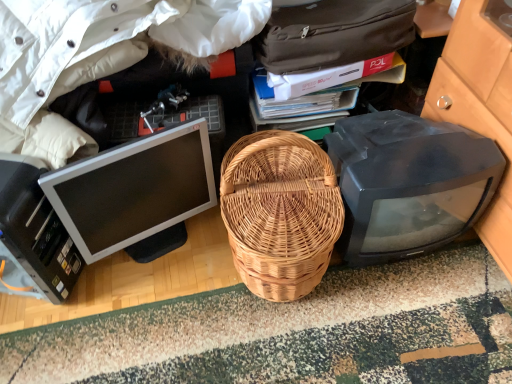
Measure the distance between matte black monitor at right, which is the 2th computer monitor in left-to-right order, and camera.

matte black monitor at right, which is the 2th computer monitor in left-to-right order, and camera are 35.65 inches apart.

Where is `white glossy computer monitor at left, arranged as the second computer monitor when viewed from the right`? white glossy computer monitor at left, arranged as the second computer monitor when viewed from the right is located at coordinates (134, 189).

Locate an element on the screen. The width and height of the screenshot is (512, 384). white cotton jacket at upper left is located at coordinates (97, 56).

Image resolution: width=512 pixels, height=384 pixels. What do you see at coordinates (33, 235) in the screenshot? I see `black plastic printer at lower left` at bounding box center [33, 235].

This screenshot has width=512, height=384. I want to click on matte black monitor at right, which is the 2th computer monitor in left-to-right order, so click(409, 183).

Based on the photo, how far apart are natural wicker picnic basket at center and white cotton jacket at upper left?

A distance of 40.53 centimeters exists between natural wicker picnic basket at center and white cotton jacket at upper left.

Which is behind, point (252, 271) or point (73, 14)?

The point (252, 271) is farther from the camera.

Considering the positions of objects natural wicker picnic basket at center and white cotton jacket at upper left in the image provided, who is in front, natural wicker picnic basket at center or white cotton jacket at upper left?

Positioned in front is white cotton jacket at upper left.

Which is more to the right, natural wicker picnic basket at center or white cotton jacket at upper left?

natural wicker picnic basket at center.

Which is correct: natural wicker picnic basket at center is inside matte black monitor at right, which is the 2th computer monitor in left-to-right order, or outside of it?

natural wicker picnic basket at center lies outside matte black monitor at right, which is the 2th computer monitor in left-to-right order.

Which of these two, natural wicker picnic basket at center or matte black monitor at right, the first computer monitor when ordered from right to left, is wider?

Wider between the two is natural wicker picnic basket at center.

Between natural wicker picnic basket at center and matte black monitor at right, which is the 2th computer monitor in left-to-right order, which one is positioned behind?

matte black monitor at right, which is the 2th computer monitor in left-to-right order, is further from the camera.

Between natural wicker picnic basket at center and matte black monitor at right, which is the 2th computer monitor in left-to-right order, which one appears on the right side from the viewer's perspective?

Positioned to the right is matte black monitor at right, which is the 2th computer monitor in left-to-right order.

Is white cotton jacket at upper left located outside matte black monitor at right, the first computer monitor when ordered from right to left?

That's correct, white cotton jacket at upper left is outside of matte black monitor at right, the first computer monitor when ordered from right to left.

Would you consider white cotton jacket at upper left to be distant from matte black monitor at right, the first computer monitor when ordered from right to left?

No, there isn't a large distance between white cotton jacket at upper left and matte black monitor at right, the first computer monitor when ordered from right to left.

Which is in front, white cotton jacket at upper left or matte black monitor at right, the first computer monitor when ordered from right to left?

white cotton jacket at upper left is more forward.

Measure the distance from black plastic printer at lower left to white glossy computer monitor at left, arranged as the second computer monitor when viewed from the right.

black plastic printer at lower left is 6.04 inches away from white glossy computer monitor at left, arranged as the second computer monitor when viewed from the right.

From a real-world perspective, is black plastic printer at lower left under white glossy computer monitor at left, arranged as the second computer monitor when viewed from the right?

No, from a real-world perspective, black plastic printer at lower left is not beneath white glossy computer monitor at left, arranged as the second computer monitor when viewed from the right.

Considering the relative positions of black plastic printer at lower left and white glossy computer monitor at left, arranged as the second computer monitor when viewed from the right, in the image provided, is black plastic printer at lower left to the left of white glossy computer monitor at left, arranged as the second computer monitor when viewed from the right, from the viewer's perspective?

Yes.

Looking at their sizes, would you say black plastic printer at lower left is wider or thinner than white glossy computer monitor at left, the 1th computer monitor when ordered from left to right?

Clearly, black plastic printer at lower left has more width compared to white glossy computer monitor at left, the 1th computer monitor when ordered from left to right.

From a real-world perspective, is natural wicker picnic basket at center physically located above or below white glossy computer monitor at left, the 1th computer monitor when ordered from left to right?

natural wicker picnic basket at center is situated higher than white glossy computer monitor at left, the 1th computer monitor when ordered from left to right, in the real world.

Based on the photo, from the image's perspective, relative to white glossy computer monitor at left, the 1th computer monitor when ordered from left to right, is natural wicker picnic basket at center above or below?

Based on their image positions, natural wicker picnic basket at center is located beneath white glossy computer monitor at left, the 1th computer monitor when ordered from left to right.

From the picture: Who is taller, natural wicker picnic basket at center or white glossy computer monitor at left, arranged as the second computer monitor when viewed from the right?

natural wicker picnic basket at center.

Is point (269, 271) closer to viewer compared to point (169, 158)?

That is True.

Considering the points (426, 225) and (316, 200), which point is in front, point (426, 225) or point (316, 200)?

Point (316, 200)

Does matte black monitor at right, which is the 2th computer monitor in left-to-right order, contain natural wicker picnic basket at center?

No, natural wicker picnic basket at center is located outside of matte black monitor at right, which is the 2th computer monitor in left-to-right order.

From a real-world perspective, is matte black monitor at right, the first computer monitor when ordered from right to left, under natural wicker picnic basket at center?

Correct, in the physical world, matte black monitor at right, the first computer monitor when ordered from right to left, is lower than natural wicker picnic basket at center.

Where is `computer monitor on the right of natural wicker picnic basket at center`? This screenshot has height=384, width=512. computer monitor on the right of natural wicker picnic basket at center is located at coordinates (409, 183).

Which of these two, black plastic printer at lower left or white cotton jacket at upper left, is thinner?

black plastic printer at lower left.

Is black plastic printer at lower left not close to white cotton jacket at upper left?

No, black plastic printer at lower left is not far away from white cotton jacket at upper left.

Consider the image. Between black plastic printer at lower left and white cotton jacket at upper left, which one has more height?

white cotton jacket at upper left.

Between black plastic printer at lower left and white cotton jacket at upper left, which one appears on the right side from the viewer's perspective?

From the viewer's perspective, white cotton jacket at upper left appears more on the right side.

This screenshot has width=512, height=384. What are the coordinates of `picnic basket behind the white cotton jacket at upper left` in the screenshot? It's located at (280, 212).

Locate an element on the screen. Image resolution: width=512 pixels, height=384 pixels. computer monitor that is the 2nd object directly below the natural wicker picnic basket at center (from a real-world perspective) is located at coordinates (409, 183).

Based on their spatial positions, is black plastic printer at lower left or white glossy computer monitor at left, arranged as the second computer monitor when viewed from the right, further from matte black monitor at right, the first computer monitor when ordered from right to left?

Among the two, black plastic printer at lower left is located further to matte black monitor at right, the first computer monitor when ordered from right to left.

Consider the image. Based on their spatial positions, is matte black monitor at right, the first computer monitor when ordered from right to left, or white cotton jacket at upper left closer to black plastic printer at lower left?

white cotton jacket at upper left.

Considering their positions, is white glossy computer monitor at left, arranged as the second computer monitor when viewed from the right, positioned closer to natural wicker picnic basket at center than white cotton jacket at upper left?

white glossy computer monitor at left, arranged as the second computer monitor when viewed from the right, is closer to natural wicker picnic basket at center.

Based on the photo, when comparing their distances from white glossy computer monitor at left, the 1th computer monitor when ordered from left to right, does white cotton jacket at upper left or black plastic printer at lower left seem closer?

Based on the image, black plastic printer at lower left appears to be nearer to white glossy computer monitor at left, the 1th computer monitor when ordered from left to right.

When comparing their distances from white cotton jacket at upper left, does white glossy computer monitor at left, arranged as the second computer monitor when viewed from the right, or matte black monitor at right, the first computer monitor when ordered from right to left, seem further?

matte black monitor at right, the first computer monitor when ordered from right to left, is positioned further to the anchor white cotton jacket at upper left.

Looking at the image, which one is located closer to black plastic printer at lower left, white cotton jacket at upper left or white glossy computer monitor at left, the 1th computer monitor when ordered from left to right?

white glossy computer monitor at left, the 1th computer monitor when ordered from left to right.

From the image, which object appears to be farther from white glossy computer monitor at left, arranged as the second computer monitor when viewed from the right, natural wicker picnic basket at center or black plastic printer at lower left?

natural wicker picnic basket at center is positioned further to the anchor white glossy computer monitor at left, arranged as the second computer monitor when viewed from the right.

Estimate the real-world distances between objects in this image. Which object is further from black plastic printer at lower left, matte black monitor at right, the first computer monitor when ordered from right to left, or white glossy computer monitor at left, the 1th computer monitor when ordered from left to right?

matte black monitor at right, the first computer monitor when ordered from right to left, is further to black plastic printer at lower left.

Where is `clothing located between black plastic printer at lower left and natural wicker picnic basket at center in the left-right direction`? The image size is (512, 384). clothing located between black plastic printer at lower left and natural wicker picnic basket at center in the left-right direction is located at coordinates (97, 56).

Identify the location of picnic basket between black plastic printer at lower left and matte black monitor at right, the first computer monitor when ordered from right to left, in the horizontal direction. Image resolution: width=512 pixels, height=384 pixels. (280, 212).

This screenshot has height=384, width=512. Identify the location of computer monitor between black plastic printer at lower left and matte black monitor at right, the first computer monitor when ordered from right to left. (134, 189).

At what (x,y) coordinates should I click in order to perform the action: click on computer monitor situated between white cotton jacket at upper left and natural wicker picnic basket at center from left to right. Please return your answer as a coordinate pair (x, y). This screenshot has width=512, height=384. Looking at the image, I should click on (134, 189).